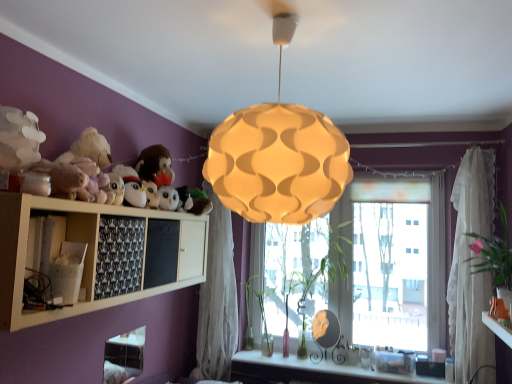
In order to click on free space above white glossy vanity at lower center (from a real-world perspective) in this screenshot , I will do `click(343, 360)`.